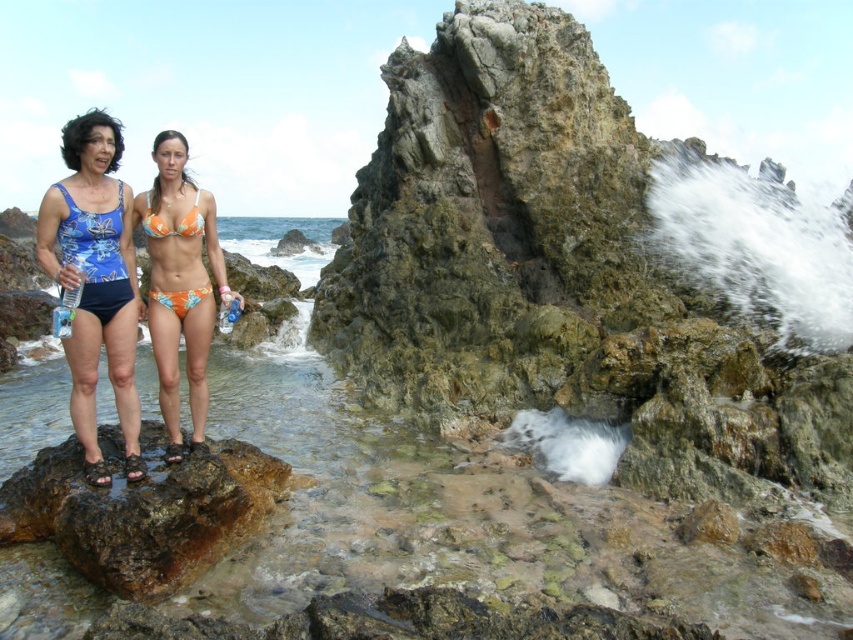
Question: Estimate the real-world distances between objects in this image. Which object is farther from the orange printed bikini at center?

Choices:
 (A) orange floral bikini at center
 (B) blue printed fabric bikini at left
 (C) brown rough rock at lower left

Answer: (A)

Question: Considering the real-world distances, which object is farthest from the orange printed bikini at center?

Choices:
 (A) orange floral bikini at center
 (B) blue printed fabric bikini at left

Answer: (A)

Question: Is orange printed bikini at center bigger than orange floral bikini at center?

Choices:
 (A) no
 (B) yes

Answer: (B)

Question: Does orange printed bikini at center appear on the left side of blue printed fabric bikini at left?

Choices:
 (A) yes
 (B) no

Answer: (A)

Question: Is brown rough rock at lower left in front of orange floral bikini at center?

Choices:
 (A) no
 (B) yes

Answer: (B)

Question: Which point is farther to the camera?

Choices:
 (A) (202, 227)
 (B) (80, 362)

Answer: (A)